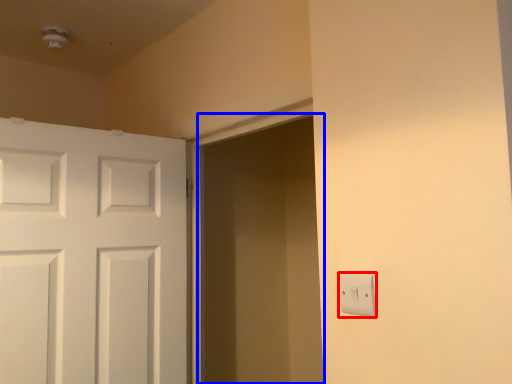
Question: Which point is closer to the camera, light switch (highlighted by a red box) or screen door (highlighted by a blue box)?

Choices:
 (A) light switch
 (B) screen door

Answer: (A)